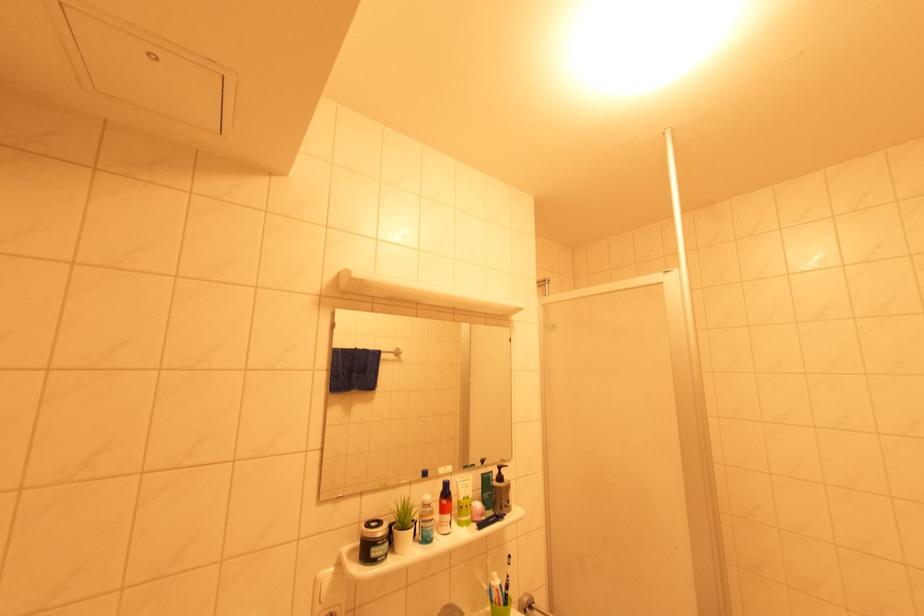
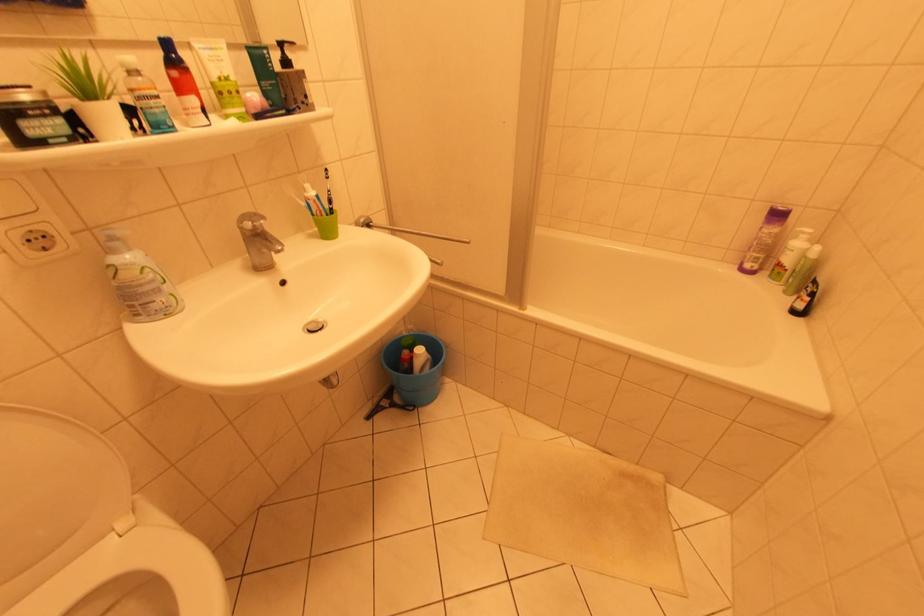
The first image is from the beginning of the video and the second image is from the end. How did the camera likely rotate when shooting the video?

The rotation direction of the camera is right-down.